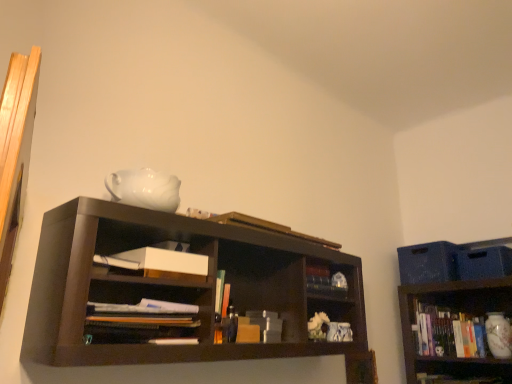
From the picture: In order to face white glossy vase at lower right, marked as the third book in a front-to-back arrangement, should I rotate leftwards or rightwards?

Turn right by 26.098 degrees to look at white glossy vase at lower right, marked as the third book in a front-to-back arrangement.

Where is `white matte paper at center`? white matte paper at center is located at coordinates (158, 261).

What do you see at coordinates (158, 261) in the screenshot? I see `white matte paper at center` at bounding box center [158, 261].

In order to face white paper at center, arranged as the second book when viewed from the top, should I rotate leftwards or rightwards?

Rotate left and turn 14.801 degrees.

Locate an element on the screen. The image size is (512, 384). white paper at center, arranged as the second book when viewed from the top is located at coordinates (143, 320).

What is the approximate width of matte white vase at lower right?

The width of matte white vase at lower right is 4.37 inches.

Find the location of `white glossy vase at lower right, the 1th book in the back-to-front sequence`. white glossy vase at lower right, the 1th book in the back-to-front sequence is located at coordinates (459, 333).

Is matte white vase at lower right oriented towards gold metallic book at upper center, the second book in the left-to-right sequence?

Yes, matte white vase at lower right is oriented towards gold metallic book at upper center, the second book in the left-to-right sequence.

Is the surface of matte white vase at lower right in direct contact with gold metallic book at upper center, the second book viewed from the back?

No, matte white vase at lower right is not next to gold metallic book at upper center, the second book viewed from the back.

Considering the relative positions of matte white vase at lower right and gold metallic book at upper center, the second book in the left-to-right sequence, in the image provided, is matte white vase at lower right to the left of gold metallic book at upper center, the second book in the left-to-right sequence, from the viewer's perspective?

In fact, matte white vase at lower right is to the right of gold metallic book at upper center, the second book in the left-to-right sequence.

Based on the photo, which is closer, (496,335) or (284,227)?

A: Point (496,335) is positioned farther from the camera compared to point (284,227).

Choose the correct answer: Is matte white vase at lower right inside white paper at center, which is the third book from back to front, or outside it?

matte white vase at lower right is spatially situated outside white paper at center, which is the third book from back to front.

From the picture: Considering the positions of objects matte white vase at lower right and white paper at center, acting as the 1th book starting from the left, in the image provided, who is more to the left, matte white vase at lower right or white paper at center, acting as the 1th book starting from the left,?

white paper at center, acting as the 1th book starting from the left, is more to the left.

What's the angular difference between matte white vase at lower right and white paper at center, arranged as the second book when viewed from the top,'s facing directions?

91.8 degrees.

Does matte white vase at lower right have a smaller size compared to white paper at center, arranged as the second book when viewed from the top?

Correct, matte white vase at lower right occupies less space than white paper at center, arranged as the second book when viewed from the top.

Is white glossy vase at lower right, acting as the 1th book starting from the right, beside matte white vase at lower right?

No, white glossy vase at lower right, acting as the 1th book starting from the right, is not in contact with matte white vase at lower right.

Between white glossy vase at lower right, the 3th book viewed from the left, and matte white vase at lower right, which one has smaller size?

Smaller between the two is matte white vase at lower right.

What's the angular difference between white glossy vase at lower right, acting as the 1th book starting from the right, and matte white vase at lower right's facing directions?

2.25 degrees.

Does point (434, 311) lie behind point (502, 356)?

Yes, it is.

Is matte white vase at lower right outside of white glossy vase at lower right, the 1th book ordered from the bottom?

Indeed, matte white vase at lower right is completely outside white glossy vase at lower right, the 1th book ordered from the bottom.

Can you see matte white vase at lower right touching white glossy vase at lower right, marked as the third book in a front-to-back arrangement?

No, matte white vase at lower right is not making contact with white glossy vase at lower right, marked as the third book in a front-to-back arrangement.

From the image's perspective, which is below, matte white vase at lower right or white glossy vase at lower right, the 1th book ordered from the bottom?

white glossy vase at lower right, the 1th book ordered from the bottom, from the image's perspective.

Which object is closer to the camera, matte white vase at lower right or white glossy vase at lower right, acting as the 1th book starting from the right?

Positioned in front is matte white vase at lower right.

How different are the orientations of gold metallic book at upper center, which ranks as the third book in bottom-to-top order, and white glossy vase at lower right, the 3th book viewed from the left, in degrees?

The angular difference between gold metallic book at upper center, which ranks as the third book in bottom-to-top order, and white glossy vase at lower right, the 3th book viewed from the left, is 91.9 degrees.

In the image, is gold metallic book at upper center, which ranks as the third book in bottom-to-top order, positioned in front of or behind white glossy vase at lower right, the 3th book viewed from the left?

In the image, gold metallic book at upper center, which ranks as the third book in bottom-to-top order, appears in front of white glossy vase at lower right, the 3th book viewed from the left.

From the image's perspective, is gold metallic book at upper center, the second book in the left-to-right sequence, beneath white glossy vase at lower right, acting as the 1th book starting from the right?

No, from the image's perspective, gold metallic book at upper center, the second book in the left-to-right sequence, is not beneath white glossy vase at lower right, acting as the 1th book starting from the right.

From a real-world perspective, between gold metallic book at upper center, the second book in the left-to-right sequence, and white glossy vase at lower right, the 1th book in the back-to-front sequence, who is vertically higher?

From a 3D spatial view, gold metallic book at upper center, the second book in the left-to-right sequence, is above.

Would you say white paper at center, arranged as the second book when viewed from the top, is outside white matte paper at center?

white paper at center, arranged as the second book when viewed from the top, is positioned outside white matte paper at center.

Can you confirm if white paper at center, acting as the 1th book starting from the left, is smaller than white matte paper at center?

No.

Where is `the 1st book below when counting from the white matte paper at center (from the image's perspective)`? This screenshot has height=384, width=512. the 1st book below when counting from the white matte paper at center (from the image's perspective) is located at coordinates (143, 320).

In terms of height, does white paper at center, which is the third book from back to front, look taller or shorter compared to white matte paper at center?

white paper at center, which is the third book from back to front, is taller than white matte paper at center.

Would you say white paper at center, marked as the 3th book in a right-to-left arrangement, is outside gold metallic book at upper center, acting as the 1th book starting from the top?

white paper at center, marked as the 3th book in a right-to-left arrangement, is positioned outside gold metallic book at upper center, acting as the 1th book starting from the top.

Considering the sizes of white paper at center, positioned as the 2th book in bottom-to-top order, and gold metallic book at upper center, which is the second book in front-to-back order, in the image, is white paper at center, positioned as the 2th book in bottom-to-top order, bigger or smaller than gold metallic book at upper center, which is the second book in front-to-back order,?

Clearly, white paper at center, positioned as the 2th book in bottom-to-top order, is larger in size than gold metallic book at upper center, which is the second book in front-to-back order.

Considering the relative sizes of white paper at center, which is the third book from back to front, and gold metallic book at upper center, the second book in the left-to-right sequence, in the image provided, is white paper at center, which is the third book from back to front, taller than gold metallic book at upper center, the second book in the left-to-right sequence,?

Indeed, white paper at center, which is the third book from back to front, has a greater height compared to gold metallic book at upper center, the second book in the left-to-right sequence.

From the image's perspective, which is above, white paper at center, marked as the 3th book in a right-to-left arrangement, or gold metallic book at upper center, acting as the 1th book starting from the top?

gold metallic book at upper center, acting as the 1th book starting from the top, appears higher in the image.

Locate an element on the screen. the 2nd book above the matte white vase at lower right (from the image's perspective) is located at coordinates (x=268, y=227).

Locate an element on the screen. The height and width of the screenshot is (384, 512). glass vase that is behind the white paper at center, marked as the 3th book in a right-to-left arrangement is located at coordinates (498, 335).

Estimate the real-world distances between objects in this image. Which object is closer to white glossy vase at lower right, the 3th book viewed from the left, white paper at center, acting as the 1th book starting from the left, or matte white vase at lower right?

Among the two, matte white vase at lower right is located nearer to white glossy vase at lower right, the 3th book viewed from the left.

From the image, which object appears to be farther from white matte paper at center, matte white vase at lower right or white glossy vase at lower right, the 1th book ordered from the bottom?

Among the two, matte white vase at lower right is located further to white matte paper at center.

Considering their positions, is white matte paper at center positioned further to matte white vase at lower right than white paper at center, arranged as the second book when viewed from the top?

white paper at center, arranged as the second book when viewed from the top.

Estimate the real-world distances between objects in this image. Which object is further from gold metallic book at upper center, the second book viewed from the back, white paper at center, positioned as the 2th book in bottom-to-top order, or matte white vase at lower right?

matte white vase at lower right.

Looking at the image, which one is located further to white glossy vase at lower right, marked as the third book in a front-to-back arrangement, white matte paper at center or matte white vase at lower right?

The object further to white glossy vase at lower right, marked as the third book in a front-to-back arrangement, is white matte paper at center.

From the image, which object appears to be nearer to white paper at center, positioned as the 2th book in bottom-to-top order, gold metallic book at upper center, the second book in the right-to-left sequence, or white glossy vase at lower right, which ranks as the third book in top-to-bottom order?

gold metallic book at upper center, the second book in the right-to-left sequence, lies closer to white paper at center, positioned as the 2th book in bottom-to-top order, than the other object.

From the image, which object appears to be farther from matte white vase at lower right, gold metallic book at upper center, the second book in the right-to-left sequence, or white glossy vase at lower right, acting as the 1th book starting from the right?

gold metallic book at upper center, the second book in the right-to-left sequence, lies further to matte white vase at lower right than the other object.

Considering their positions, is white glossy vase at lower right, acting as the 1th book starting from the right, positioned closer to matte white vase at lower right than gold metallic book at upper center, which is the second book in front-to-back order?

Based on the image, white glossy vase at lower right, acting as the 1th book starting from the right, appears to be nearer to matte white vase at lower right.

The width and height of the screenshot is (512, 384). Identify the location of book between gold metallic book at upper center, the second book viewed from the back, and matte white vase at lower right, in the horizontal direction. (459, 333).

This screenshot has height=384, width=512. Identify the location of book between white paper at center, arranged as the second book when viewed from the top, and white glossy vase at lower right, the 3th book viewed from the left, in the horizontal direction. (268, 227).

Where is `book located between white matte paper at center and gold metallic book at upper center, which ranks as the third book in bottom-to-top order, in the left-right direction`? book located between white matte paper at center and gold metallic book at upper center, which ranks as the third book in bottom-to-top order, in the left-right direction is located at coordinates (143, 320).